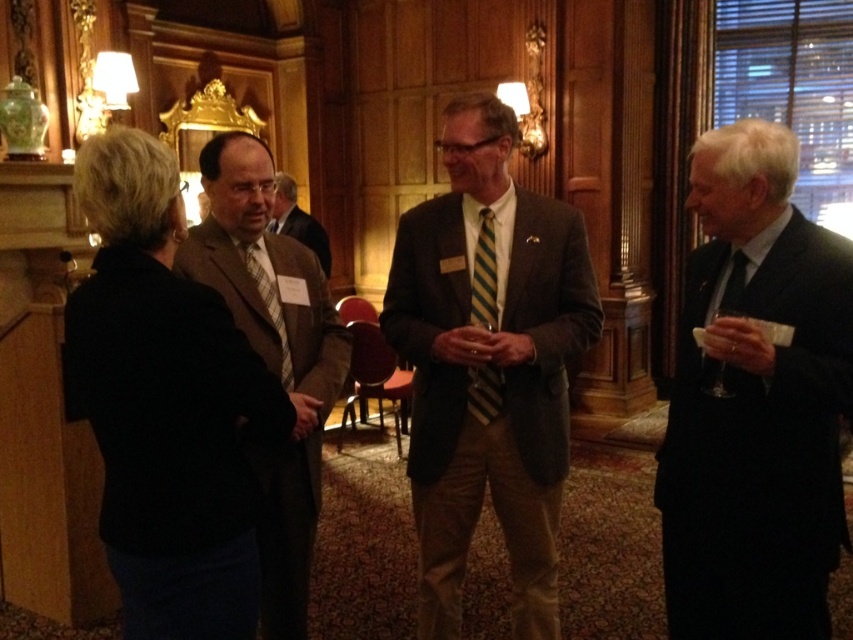
You are at a formal event and need to locate the dark brown suit at center and the matte green striped tie at right. From the perspective of someone standing in front of them, which one is positioned to the left?

The dark brown suit at center is to the left of the matte green striped tie at right, so from the perspective of someone standing in front of them, the dark brown suit at center is positioned to the left.